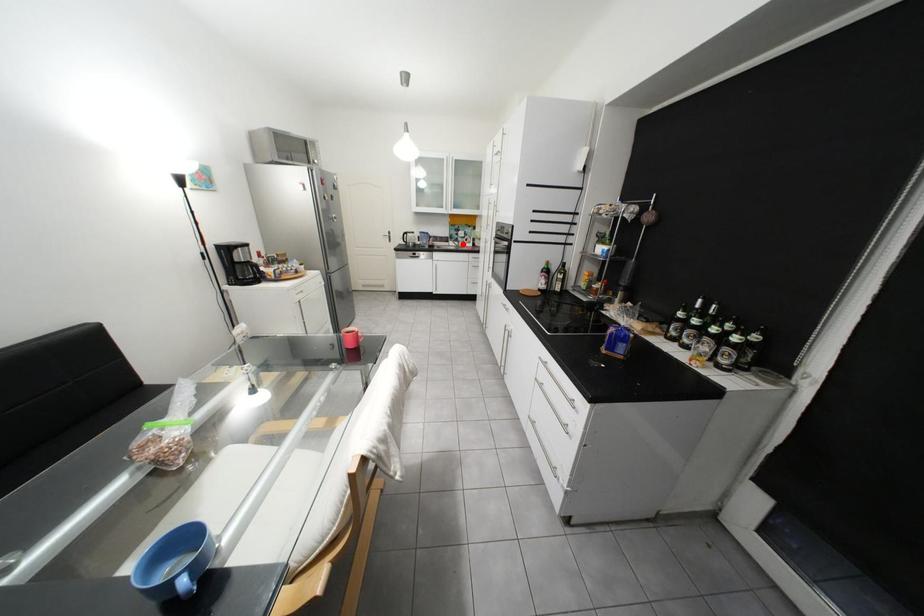
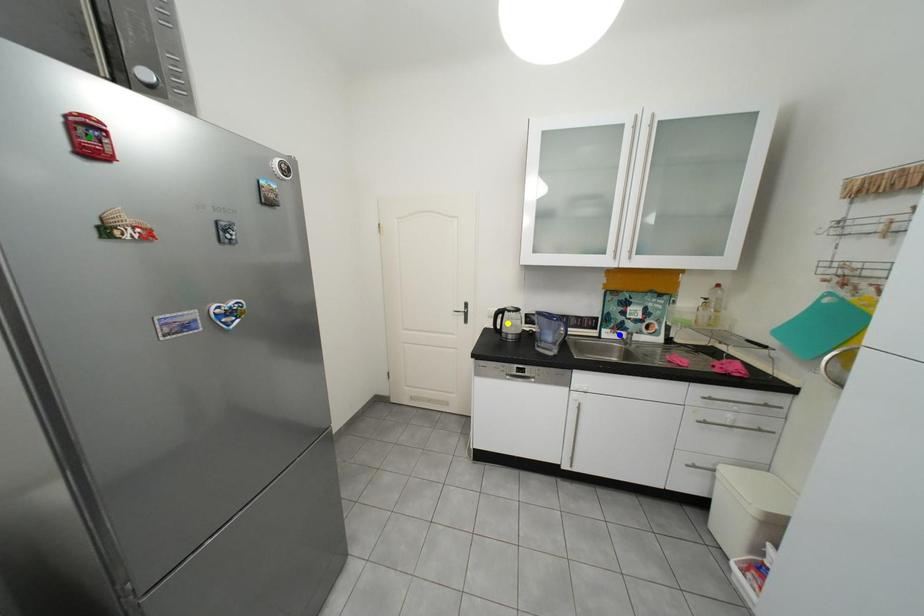
Question: I am providing you with two images of the same scene from different viewpoints. A red point is marked on the first image. You are given multiple points on the second image. Which spot in image 2 lines up with the point in image 1?

Choices:
 (A) green point
 (B) yellow point
 (C) blue point

Answer: (C)